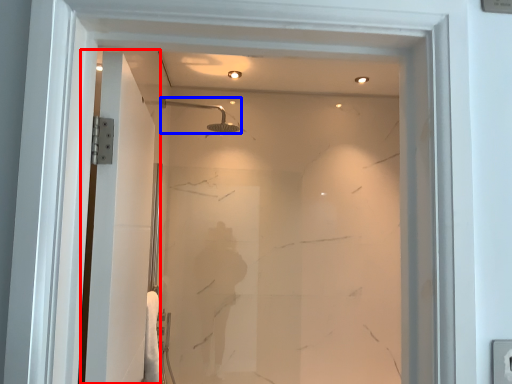
Question: Which point is further to the camera, screen door (highlighted by a red box) or shower (highlighted by a blue box)?

Choices:
 (A) screen door
 (B) shower

Answer: (B)